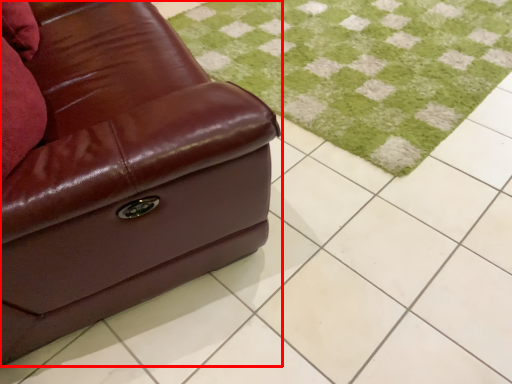
Question: Where is studio couch (annotated by the red box) located in relation to grass in the image?

Choices:
 (A) left
 (B) right

Answer: (A)